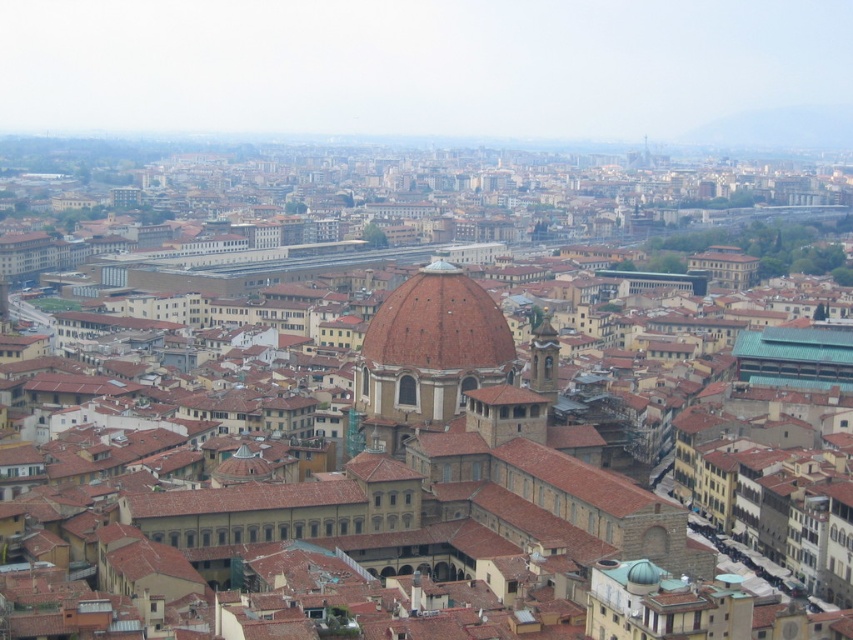
You are standing in the center of Florence, Italy, looking at the point marked at coordinates (438, 324). What architectural feature does this point highlight?

The point at coordinates (438, 324) highlights the brown matte dome at center, which is part of the Santa Maria del Fiore Cathedral, also known as the Duomo di Firenze.